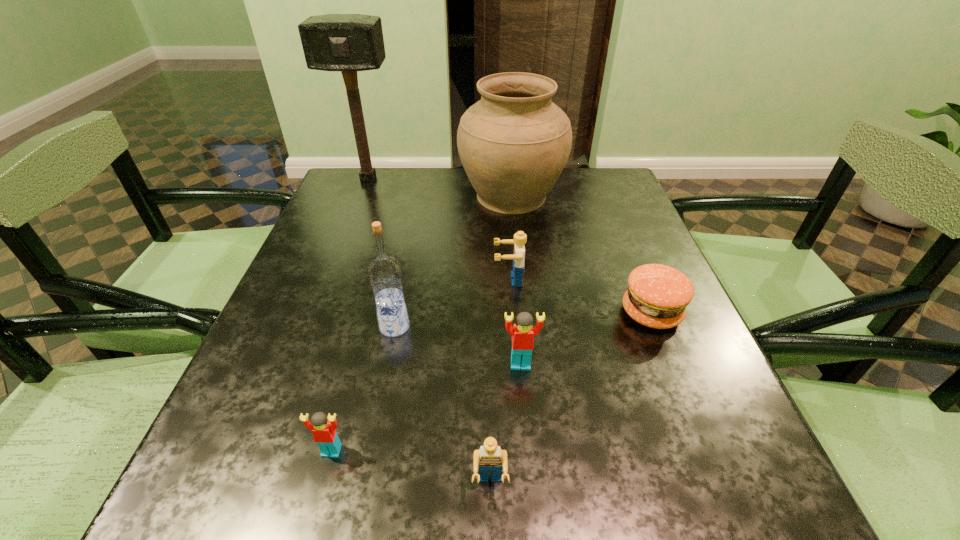
Where is `vacant point located 0.060m on the left of the patty`? This screenshot has width=960, height=540. vacant point located 0.060m on the left of the patty is located at coordinates (590, 313).

The height and width of the screenshot is (540, 960). What are the coordinates of `mallet that is positioned at the far edge` in the screenshot? It's located at (348, 43).

Locate an element on the screen. The image size is (960, 540). urn that is positioned at the far edge is located at coordinates (514, 143).

Locate an element on the screen. object that is at the near edge is located at coordinates (489, 458).

Find the location of a particular element. mallet at the left edge is located at coordinates tap(348, 43).

Locate an element on the screen. Image resolution: width=960 pixels, height=540 pixels. Lego at the left edge is located at coordinates (323, 428).

Where is `object that is at the right edge`? This screenshot has height=540, width=960. object that is at the right edge is located at coordinates (657, 296).

Find the location of a particular element. object located in the far left corner section of the desktop is located at coordinates (348, 43).

At what (x,y) coordinates should I click in order to perform the action: click on vacant space at the far edge of the desktop. Please return your answer as a coordinate pair (x, y). The image size is (960, 540). Looking at the image, I should click on (456, 202).

Find the location of a particular element. The image size is (960, 540). blank area at the near edge is located at coordinates (389, 501).